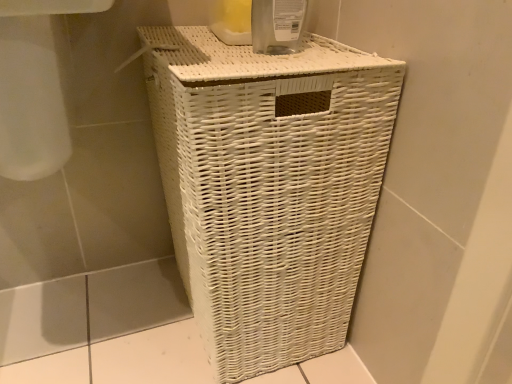
Locate an element on the screen. The image size is (512, 384). free space in front of transparent plastic bottle at upper center is located at coordinates (297, 69).